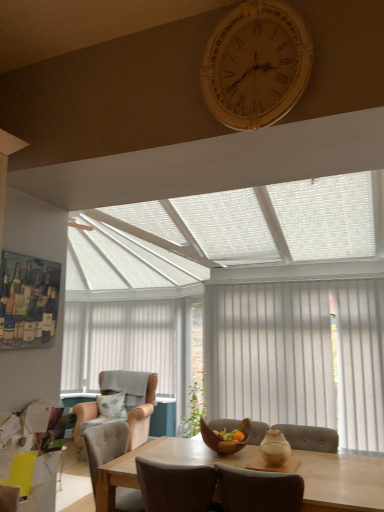
Question: Can you confirm if beige fabric blind at center is bigger than white vertical blinds at right?

Choices:
 (A) no
 (B) yes

Answer: (B)

Question: Is beige fabric blind at center to the left of white vertical blinds at right from the viewer's perspective?

Choices:
 (A) yes
 (B) no

Answer: (A)

Question: Considering the relative sizes of beige fabric blind at center and white vertical blinds at right in the image provided, is beige fabric blind at center taller than white vertical blinds at right?

Choices:
 (A) yes
 (B) no

Answer: (A)

Question: Would you say white vertical blinds at right is part of beige fabric blind at center's contents?

Choices:
 (A) yes
 (B) no

Answer: (B)

Question: From the image's perspective, is beige fabric blind at center beneath white vertical blinds at right?

Choices:
 (A) no
 (B) yes

Answer: (B)

Question: Considering the relative positions of wooden clock at upper center and beige fabric blind at center in the image provided, is wooden clock at upper center to the left or to the right of beige fabric blind at center?

Choices:
 (A) right
 (B) left

Answer: (A)

Question: Considering the positions of wooden clock at upper center and beige fabric blind at center in the image, is wooden clock at upper center wider or thinner than beige fabric blind at center?

Choices:
 (A) thin
 (B) wide

Answer: (A)

Question: Is wooden clock at upper center spatially inside beige fabric blind at center, or outside of it?

Choices:
 (A) inside
 (B) outside

Answer: (B)

Question: From the image's perspective, is wooden clock at upper center positioned above or below beige fabric blind at center?

Choices:
 (A) below
 (B) above

Answer: (B)

Question: Is light wood table at center wider or thinner than wooden clock at upper center?

Choices:
 (A) wide
 (B) thin

Answer: (A)

Question: Is light wood table at center to the left or to the right of wooden clock at upper center in the image?

Choices:
 (A) left
 (B) right

Answer: (B)

Question: Looking at the image, does light wood table at center seem bigger or smaller compared to wooden clock at upper center?

Choices:
 (A) big
 (B) small

Answer: (A)

Question: From the image's perspective, relative to wooden clock at upper center, is light wood table at center above or below?

Choices:
 (A) above
 (B) below

Answer: (B)

Question: In the image, is fluffy fabric pillow at center positioned in front of or behind light wood table at center?

Choices:
 (A) front
 (B) behind

Answer: (B)

Question: Would you say fluffy fabric pillow at center is to the left or to the right of light wood table at center in the picture?

Choices:
 (A) right
 (B) left

Answer: (B)